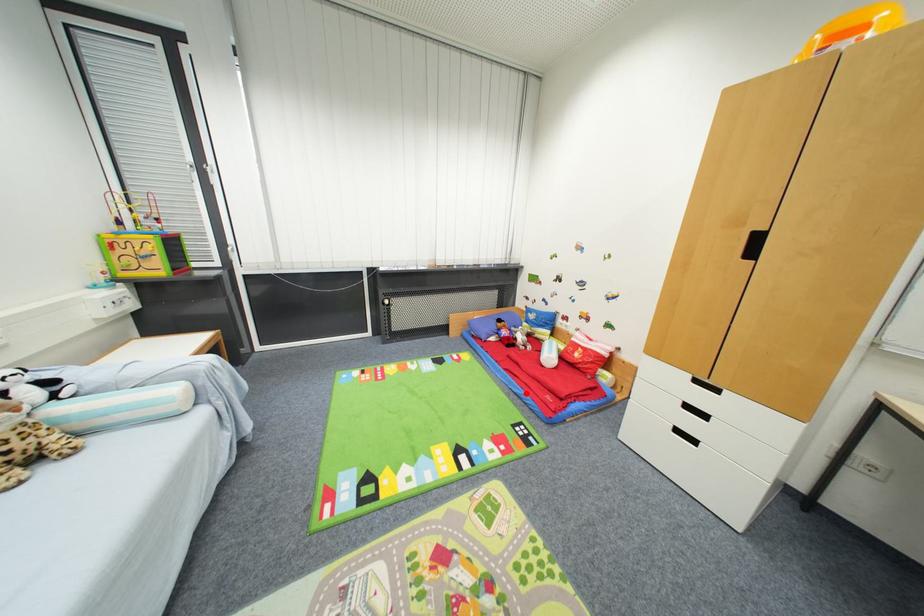
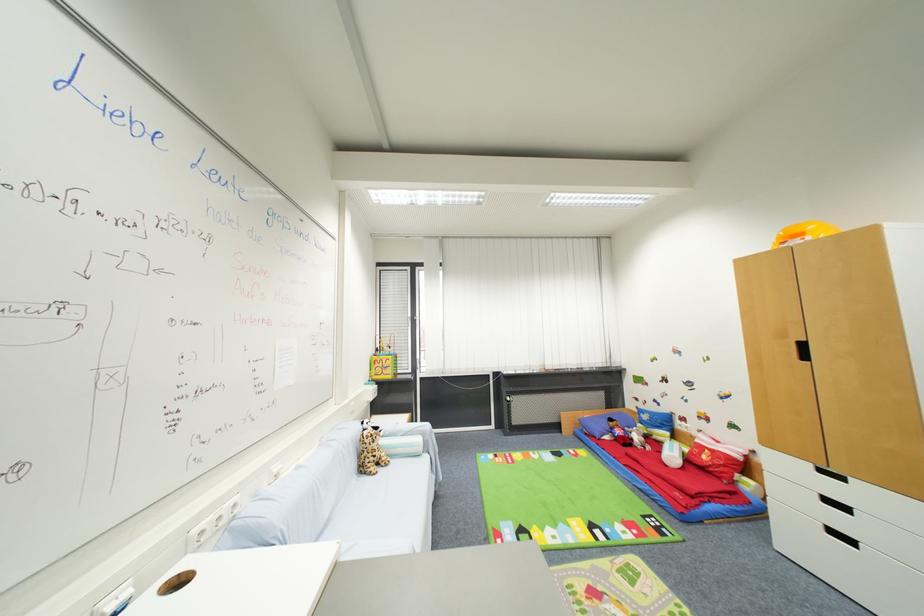
Question: I am providing you with two images of the same scene from different viewpoints. Given a red point in image1, look at the same physical point in image2. Is it:

Choices:
 (A) Closer to the viewpoint
 (B) Farther from the viewpoint

Answer: (A)